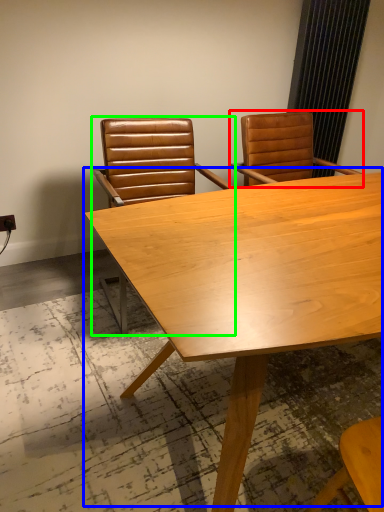
Question: Which is nearer to the chair (highlighted by a red box)? table (highlighted by a blue box) or chair (highlighted by a green box).

Choices:
 (A) table
 (B) chair

Answer: (B)